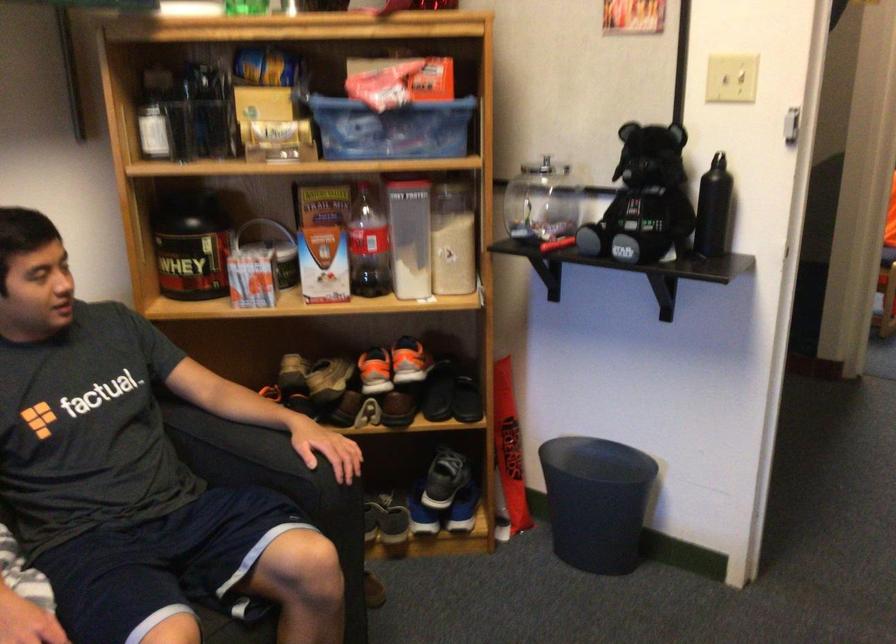
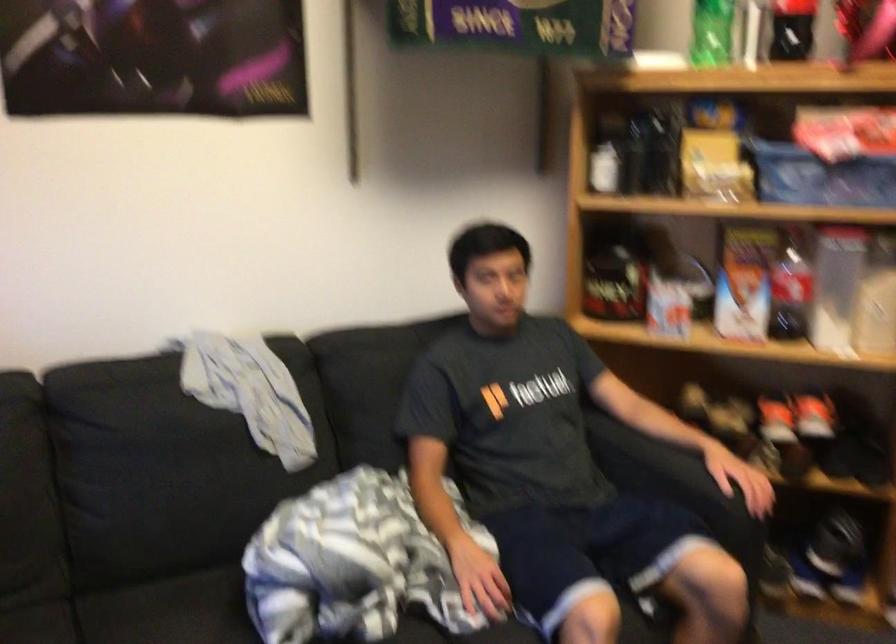
What movement of the cameraman would produce the second image?

The movement direction of the cameraman is left, backward.